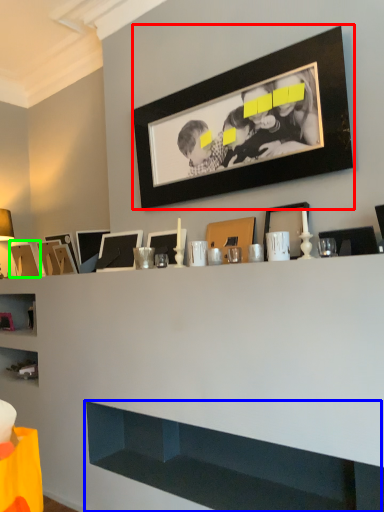
Question: Estimate the real-world distances between objects in this image. Which object is closer to picture frame (highlighted by a red box), cabinet (highlighted by a blue box) or picture frame (highlighted by a green box)?

Choices:
 (A) cabinet
 (B) picture frame

Answer: (A)